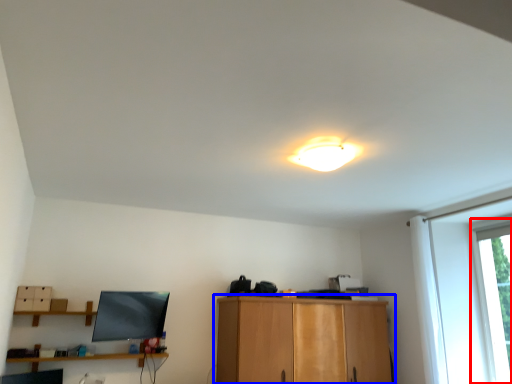
Question: Which point is closer to the camera, window (highlighted by a red box) or cabinetry (highlighted by a blue box)?

Choices:
 (A) window
 (B) cabinetry

Answer: (A)